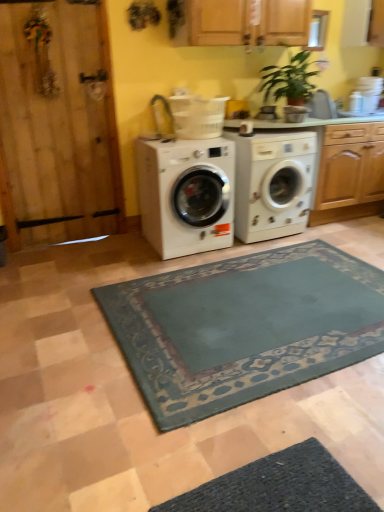
Question: Should I look upward or downward to see white glossy washing machine at center, placed as the first washing machine when sorted from left to right?

Choices:
 (A) down
 (B) up

Answer: (B)

Question: Is white glossy washing machine at center, placed as the first washing machine when sorted from left to right, looking in the opposite direction of white glossy washing machine at center, which is the second washing machine from left to right?

Choices:
 (A) no
 (B) yes

Answer: (A)

Question: Is white glossy washing machine at center, the first washing machine from the right, inside white glossy washing machine at center, which ranks as the 2th washing machine in right-to-left order?

Choices:
 (A) no
 (B) yes

Answer: (A)

Question: Does white glossy washing machine at center, placed as the first washing machine when sorted from left to right, have a greater width compared to white glossy washing machine at center, which is the second washing machine from left to right?

Choices:
 (A) yes
 (B) no

Answer: (A)

Question: Does white glossy washing machine at center, which ranks as the 2th washing machine in right-to-left order, have a larger size compared to white glossy washing machine at center, which is the second washing machine from left to right?

Choices:
 (A) yes
 (B) no

Answer: (A)

Question: From the image's perspective, is white glossy washing machine at center, which ranks as the 2th washing machine in right-to-left order, on top of white glossy washing machine at center, which is the second washing machine from left to right?

Choices:
 (A) no
 (B) yes

Answer: (A)

Question: Is white glossy washing machine at center, which ranks as the 2th washing machine in right-to-left order, far away from white glossy washing machine at center, which is the second washing machine from left to right?

Choices:
 (A) yes
 (B) no

Answer: (B)

Question: Is white glossy washing machine at center, which is the second washing machine from left to right, touching white glossy washing machine at center, placed as the first washing machine when sorted from left to right?

Choices:
 (A) yes
 (B) no

Answer: (B)

Question: Could white glossy washing machine at center, which ranks as the 2th washing machine in right-to-left order, be considered to be inside white glossy washing machine at center, which is the second washing machine from left to right?

Choices:
 (A) yes
 (B) no

Answer: (B)

Question: From a real-world perspective, is white glossy washing machine at center, the first washing machine from the right, on white glossy washing machine at center, which ranks as the 2th washing machine in right-to-left order?

Choices:
 (A) yes
 (B) no

Answer: (B)

Question: From the image's perspective, is white glossy washing machine at center, which is the second washing machine from left to right, over white glossy washing machine at center, which ranks as the 2th washing machine in right-to-left order?

Choices:
 (A) yes
 (B) no

Answer: (A)

Question: Is white glossy washing machine at center, the first washing machine from the right, to the right of white glossy washing machine at center, which ranks as the 2th washing machine in right-to-left order, from the viewer's perspective?

Choices:
 (A) yes
 (B) no

Answer: (A)

Question: Is white glossy washing machine at center, the first washing machine from the right, further to the viewer compared to white glossy washing machine at center, placed as the first washing machine when sorted from left to right?

Choices:
 (A) yes
 (B) no

Answer: (A)

Question: Considering the positions of white glossy washing machine at center, the first washing machine from the right, and white glossy washing machine at center, which ranks as the 2th washing machine in right-to-left order, in the image, is white glossy washing machine at center, the first washing machine from the right, wider or thinner than white glossy washing machine at center, which ranks as the 2th washing machine in right-to-left order,?

Choices:
 (A) wide
 (B) thin

Answer: (B)